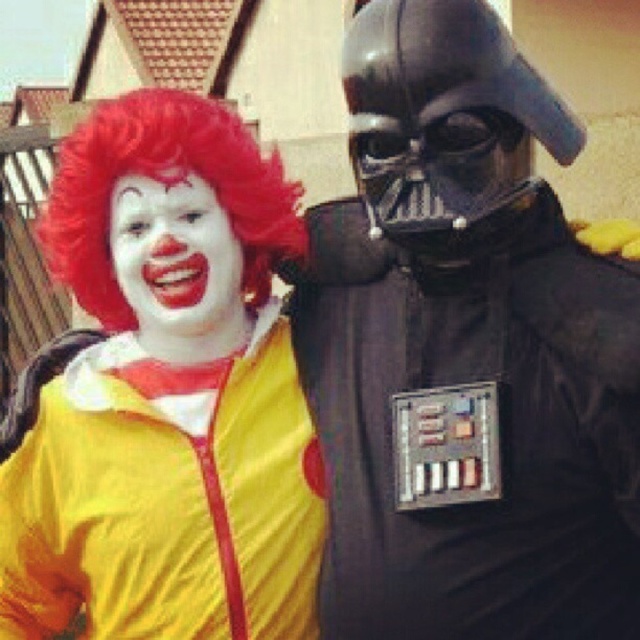
From the picture: You are at a costume party and want to take a photo with the yellow matte clown costume at left and the black matte armor at center. If you position yourself between them, which costume will be on your left side?

The yellow matte clown costume at left is to the left of the black matte armor at center, so when you stand between them, the yellow matte clown costume at left will be on your left side.

You are a photographer standing at the camera position. You want to take a photo of the two costumed individuals. The focus distance of your camera is set to 36.87 meters. Will the point at coordinates point (221,339) be in focus?

The distance of point (221,339) from the camera is exactly 36.87 meters, so yes, the point at coordinates point (221,339) will be in focus since it matches the focus distance.

You are a photographer at a costume event. You need to position the black matte armor at center and the red synthetic wig at left so that they are facing each other. Based on their current positions, which character should move to the left to face the other?

The black matte armor at center should move to the left to face the red synthetic wig at left since it is currently positioned to the right of it.